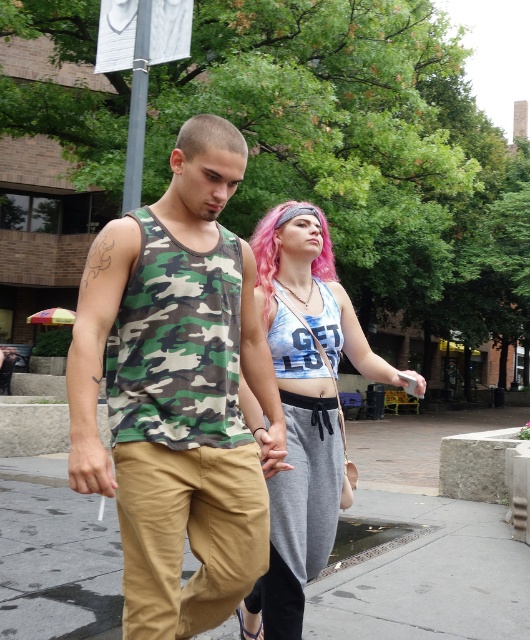
You are standing at the point marked by coordinates point (68, 404). You want to throw a small ball to a friend who is standing where you are currently located. If the ball travels in a straight line, will it reach your friend before hitting any obstacles?

The point (68, 404) and viewer are 8.51 feet apart from each other. Since the ball travels in a straight line towards the friend, it will reach them without hitting obstacles as there are no objects mentioned in the scene blocking the path.

You are a photographer taking a picture of two people walking on a city sidewalk. You notice two points marked in the image. The first point is at coordinates point (189, 326) and the second point is at point (325, 276). Which point is closer to your camera lens?

Point (189, 326) is closer to the camera lens than point (325, 276).